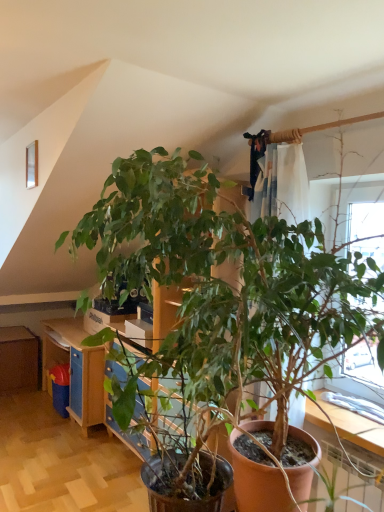
Question: Are blue painted wood dresser at center, which is the first dresser in right-to-left order, and brown wooden dresser at left, which appears as the first dresser when viewed from the left, beside each other?

Choices:
 (A) no
 (B) yes

Answer: (A)

Question: Is blue painted wood dresser at center, which is the first dresser in right-to-left order, thinner than brown wooden dresser at left, which appears as the 1th dresser when viewed from the back?

Choices:
 (A) yes
 (B) no

Answer: (A)

Question: Is blue painted wood dresser at center, positioned as the 1th dresser in front-to-back order, looking in the opposite direction of brown wooden dresser at left, placed as the 2th dresser when sorted from right to left?

Choices:
 (A) no
 (B) yes

Answer: (A)

Question: From the image's perspective, is blue painted wood dresser at center, positioned as the 1th dresser in front-to-back order, beneath brown wooden dresser at left, which appears as the 1th dresser when viewed from the back?

Choices:
 (A) no
 (B) yes

Answer: (A)

Question: Is blue painted wood dresser at center, which is the first dresser in right-to-left order, located outside brown wooden dresser at left, which appears as the 1th dresser when viewed from the back?

Choices:
 (A) yes
 (B) no

Answer: (A)

Question: Does blue painted wood dresser at center, which is the 2th dresser in back-to-front order, have a greater height compared to brown wooden dresser at left, which appears as the 1th dresser when viewed from the back?

Choices:
 (A) yes
 (B) no

Answer: (A)

Question: From a real-world perspective, is brown wooden dresser at left, marked as the second dresser in a front-to-back arrangement, on blue painted wood dresser at center, positioned as the 1th dresser in front-to-back order?

Choices:
 (A) yes
 (B) no

Answer: (B)

Question: Could you tell me if brown wooden dresser at left, marked as the second dresser in a front-to-back arrangement, is facing blue painted wood dresser at center, which is the 2th dresser in back-to-front order?

Choices:
 (A) yes
 (B) no

Answer: (A)

Question: Is brown wooden dresser at left, marked as the second dresser in a front-to-back arrangement, positioned before blue painted wood dresser at center, positioned as the 1th dresser in front-to-back order?

Choices:
 (A) no
 (B) yes

Answer: (A)

Question: Is brown wooden dresser at left, which appears as the first dresser when viewed from the left, positioned behind blue painted wood dresser at center, positioned as the 1th dresser in front-to-back order?

Choices:
 (A) no
 (B) yes

Answer: (B)

Question: Is brown wooden dresser at left, placed as the 2th dresser when sorted from right to left, outside blue painted wood dresser at center, which is the 2th dresser in back-to-front order?

Choices:
 (A) no
 (B) yes

Answer: (B)

Question: Can you confirm if brown wooden dresser at left, marked as the second dresser in a front-to-back arrangement, is bigger than blue painted wood dresser at center, positioned as the 1th dresser in front-to-back order?

Choices:
 (A) no
 (B) yes

Answer: (A)

Question: Is brown wooden dresser at left, placed as the 2th dresser when sorted from right to left, to the left or to the right of blue painted wood dresser at center, the 2th dresser in the left-to-right sequence, in the image?

Choices:
 (A) left
 (B) right

Answer: (A)